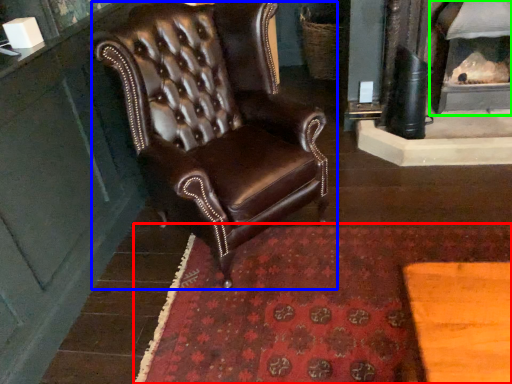
Question: Which object is the farthest from mat (highlighted by a red box)? Choose among these: chair (highlighted by a blue box) or fireplace (highlighted by a green box).

Choices:
 (A) chair
 (B) fireplace

Answer: (B)